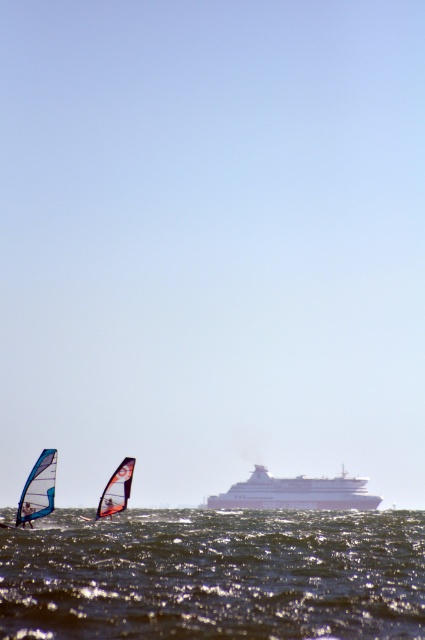
Does white matte sail at lower left have a greater width compared to white sail at center?

Correct, the width of white matte sail at lower left exceeds that of white sail at center.

Is white matte sail at lower left smaller than white sail at center?

No.

Between point (121, 483) and point (27, 520), which one is positioned behind?

Positioned behind is point (121, 483).

You are a GUI agent. You are given a task and a screenshot of the screen. Output one action in this format:
    pyautogui.click(x=<x>, y=<y>)
    Task: Click on the white matte sail at lower left
    
    Given the screenshot: What is the action you would take?
    pyautogui.click(x=116, y=490)

Is white glossy cruise ship at center thinner than translucent blue sail at lower left?

No, white glossy cruise ship at center is not thinner than translucent blue sail at lower left.

Between point (292, 484) and point (34, 493), which one is positioned in front?

Positioned in front is point (34, 493).

The height and width of the screenshot is (640, 425). What are the coordinates of `white glossy cruise ship at center` in the screenshot? It's located at (295, 492).

Between shiny dark water at lower center and white glossy cruise ship at center, which one has more height?

Result: Standing taller between the two is shiny dark water at lower center.

Can you confirm if shiny dark water at lower center is positioned above white glossy cruise ship at center?

Yes, shiny dark water at lower center is above white glossy cruise ship at center.

Identify the location of shiny dark water at lower center. (215, 576).

Find the location of `shiny dark water at lower center`. shiny dark water at lower center is located at coordinates (215, 576).